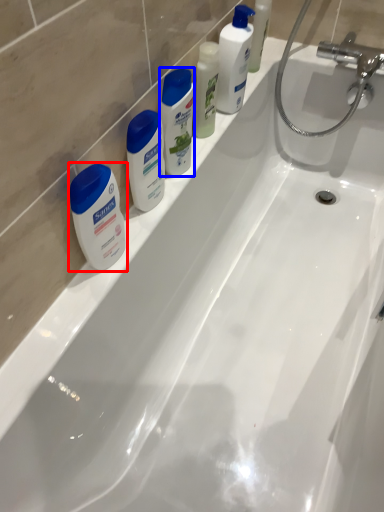
Question: Which object is closer to the camera taking this photo, toiletry (highlighted by a red box) or cleaning product (highlighted by a blue box)?

Choices:
 (A) toiletry
 (B) cleaning product

Answer: (A)